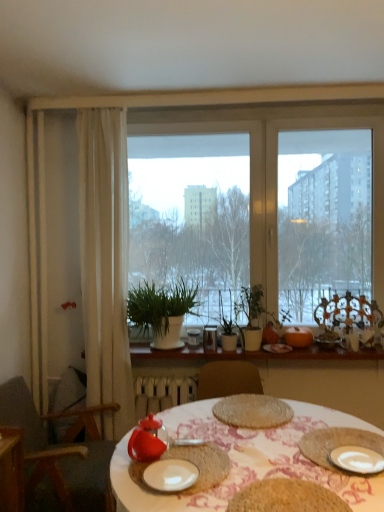
Question: Is white sheer curtain at left looking in the opposite direction of green matte plant at center?

Choices:
 (A) no
 (B) yes

Answer: (A)

Question: Is white sheer curtain at left not inside green matte plant at center?

Choices:
 (A) yes
 (B) no

Answer: (A)

Question: Could green matte plant at center be considered to be inside white sheer curtain at left?

Choices:
 (A) yes
 (B) no

Answer: (B)

Question: Does white sheer curtain at left appear on the left side of green matte plant at center?

Choices:
 (A) no
 (B) yes

Answer: (B)

Question: From a real-world perspective, is white sheer curtain at left over green matte plant at center?

Choices:
 (A) yes
 (B) no

Answer: (A)

Question: In the image, is transparent glass window at center positioned in front of or behind brown woven placemat at center, the second food when ordered from back to front?

Choices:
 (A) front
 (B) behind

Answer: (B)

Question: Is transparent glass window at center taller or shorter than brown woven placemat at center, acting as the second food starting from the top?

Choices:
 (A) short
 (B) tall

Answer: (B)

Question: Considering the positions of transparent glass window at center and brown woven placemat at center, acting as the second food starting from the top, in the image, is transparent glass window at center wider or thinner than brown woven placemat at center, acting as the second food starting from the top,?

Choices:
 (A) wide
 (B) thin

Answer: (B)

Question: In terms of size, does transparent glass window at center appear bigger or smaller than brown woven placemat at center, which appears as the 1th food when ordered from the bottom?

Choices:
 (A) small
 (B) big

Answer: (B)

Question: From a real-world perspective, is transparent glass window at center positioned above or below white sheer curtain at left?

Choices:
 (A) above
 (B) below

Answer: (A)

Question: Considering their positions, is transparent glass window at center located in front of or behind white sheer curtain at left?

Choices:
 (A) behind
 (B) front

Answer: (A)

Question: Looking at the image, does transparent glass window at center seem bigger or smaller compared to white sheer curtain at left?

Choices:
 (A) small
 (B) big

Answer: (B)

Question: Is transparent glass window at center inside or outside of white sheer curtain at left?

Choices:
 (A) inside
 (B) outside

Answer: (B)

Question: Is wooden chair at left bigger or smaller than white ceramic plate at lower right, the second plate from the left?

Choices:
 (A) small
 (B) big

Answer: (B)

Question: Which is correct: wooden chair at left is inside white ceramic plate at lower right, the second plate from the left, or outside of it?

Choices:
 (A) inside
 (B) outside

Answer: (B)